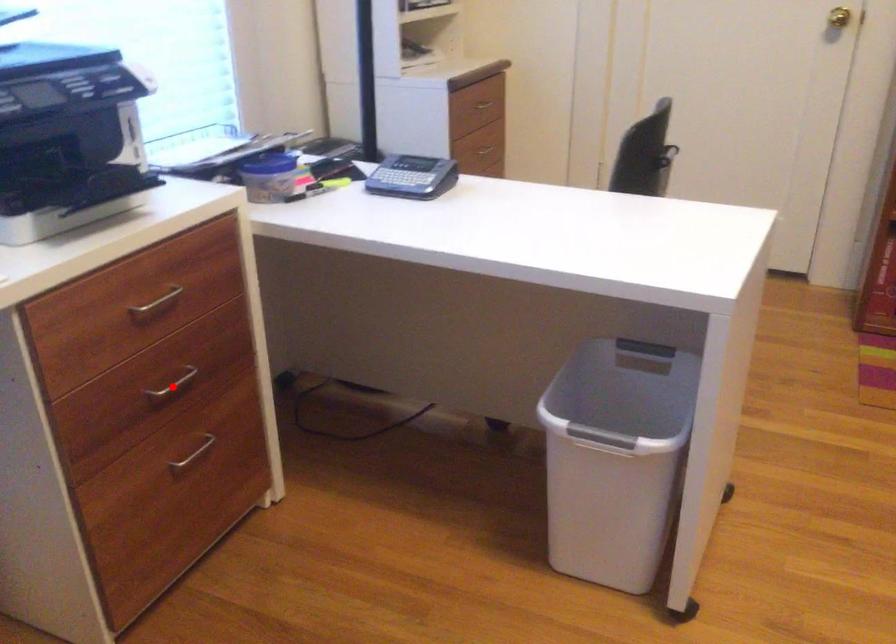
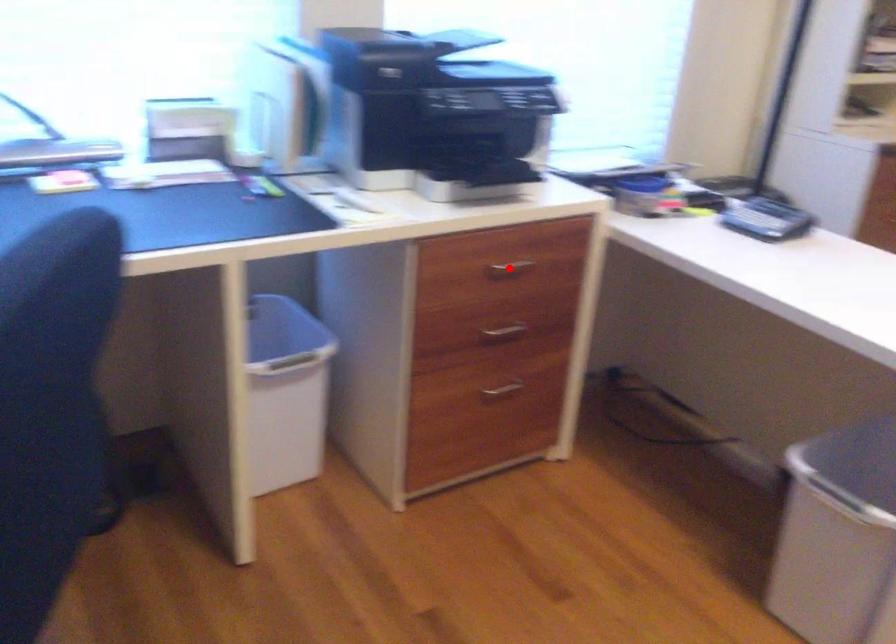
I am providing you with two images of the same scene from different viewpoints. A red point is marked on the first image and another point is marked on the second image. Are the points marked in image1 and image2 representing the same 3D position?

No